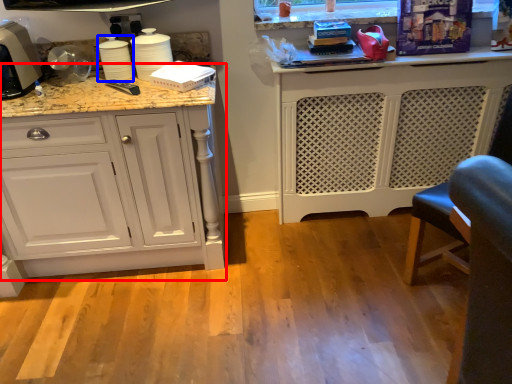
Question: Which object appears farthest to the camera in this image, cabinetry (highlighted by a red box) or appliance (highlighted by a blue box)?

Choices:
 (A) cabinetry
 (B) appliance

Answer: (B)